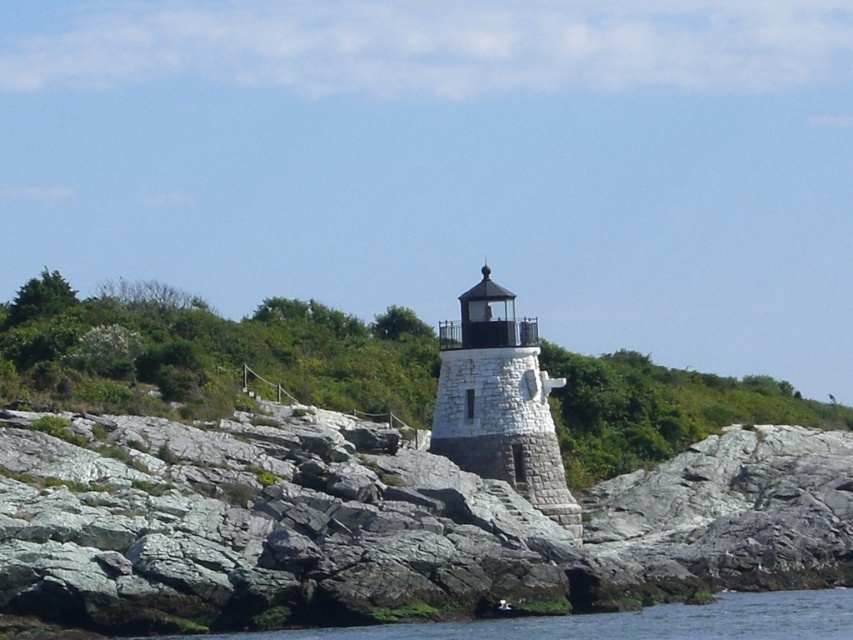
Question: Which of the following is the closest to the observer?

Choices:
 (A) white stone lighthouse at center
 (B) gray stone at center

Answer: (B)

Question: Which point is farther to the camera?

Choices:
 (A) (164, 586)
 (B) (498, 467)

Answer: (B)

Question: Is gray stone at center to the right of white stone lighthouse at center from the viewer's perspective?

Choices:
 (A) no
 (B) yes

Answer: (B)

Question: From the image, what is the correct spatial relationship of gray stone at center in relation to white stone lighthouse at center?

Choices:
 (A) left
 (B) right

Answer: (B)

Question: Which point appears closest to the camera in this image?

Choices:
 (A) (683, 566)
 (B) (482, 371)

Answer: (A)

Question: Can you confirm if gray stone at center is bigger than white stone lighthouse at center?

Choices:
 (A) no
 (B) yes

Answer: (B)